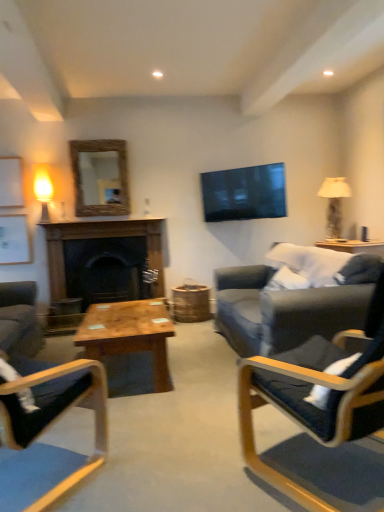
Identify the location of vacant area located to the right-hand side of wooden armchair at center, which appears as the second chair when viewed from the right. (158, 456).